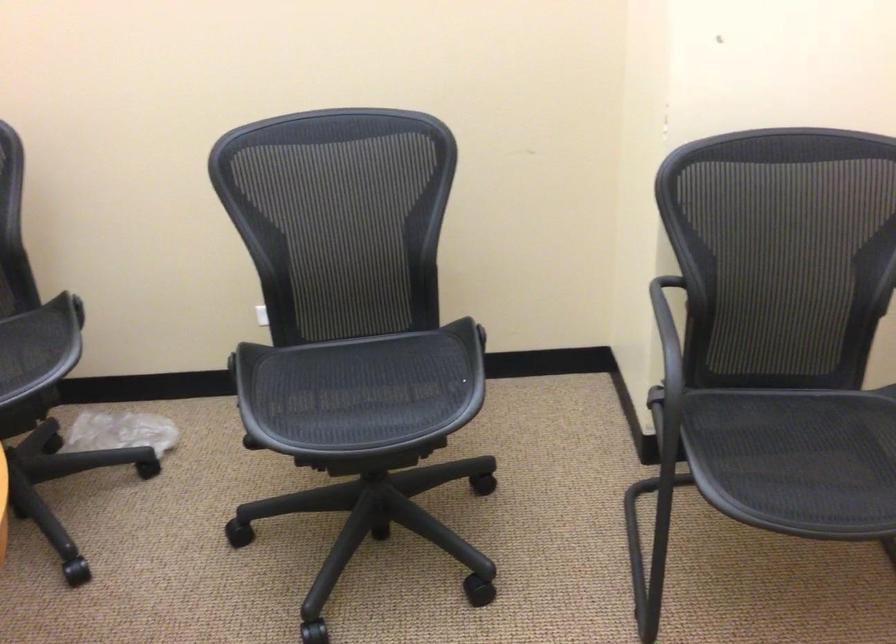
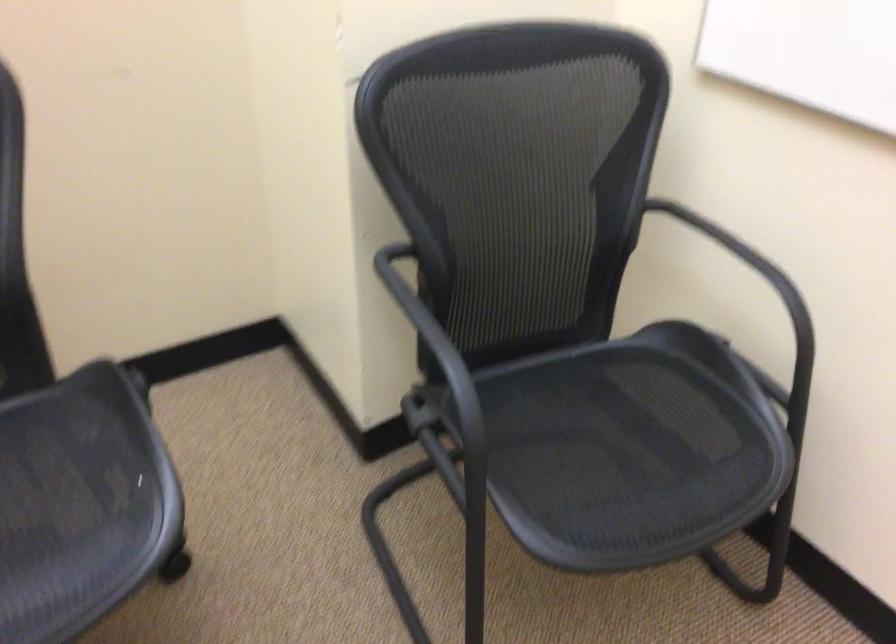
In the second image, find the point that corresponds to pixel 427 389 in the first image.

(80, 503)